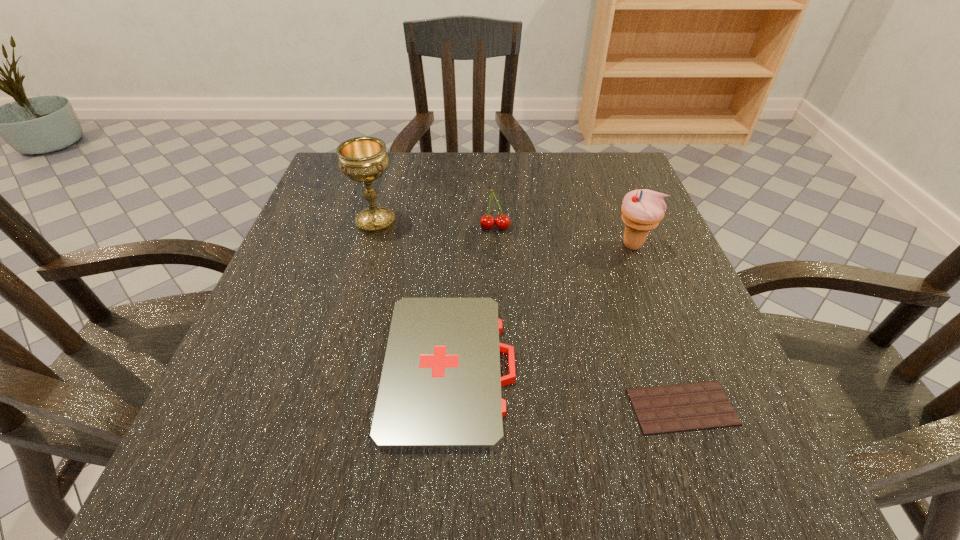
The image size is (960, 540). I want to click on the leftmost object, so click(362, 159).

Where is `the tallest object`? the tallest object is located at coordinates (362, 159).

You are a GUI agent. You are given a task and a screenshot of the screen. Output one action in this format:
    pyautogui.click(x=<x>, y=<y>)
    Task: Click on the icecream
    This screenshot has width=960, height=540.
    Given the screenshot: What is the action you would take?
    pyautogui.click(x=642, y=210)

Find the location of a particular element. The width and height of the screenshot is (960, 540). cherry is located at coordinates (487, 222).

Where is `the first-aid kit`? This screenshot has width=960, height=540. the first-aid kit is located at coordinates [x=440, y=389].

You are a GUI agent. You are given a task and a screenshot of the screen. Output one action in this format:
    pyautogui.click(x=<x>, y=<y>)
    Task: Click on the chocolate bar
    The image size is (960, 540).
    Given the screenshot: What is the action you would take?
    pyautogui.click(x=695, y=406)

Where is `free location located 0.090m on the back of the chalice`? The width and height of the screenshot is (960, 540). free location located 0.090m on the back of the chalice is located at coordinates (386, 186).

Where is `blank area located 0.320m on the left of the second tallest object`? blank area located 0.320m on the left of the second tallest object is located at coordinates (448, 245).

Locate an element on the screen. Image resolution: width=960 pixels, height=540 pixels. vacant space positioned 0.350m with the stems of the third tallest object pointing upwards is located at coordinates (501, 385).

Identify the location of vacant space located on handle side the first-aid kit. (575, 367).